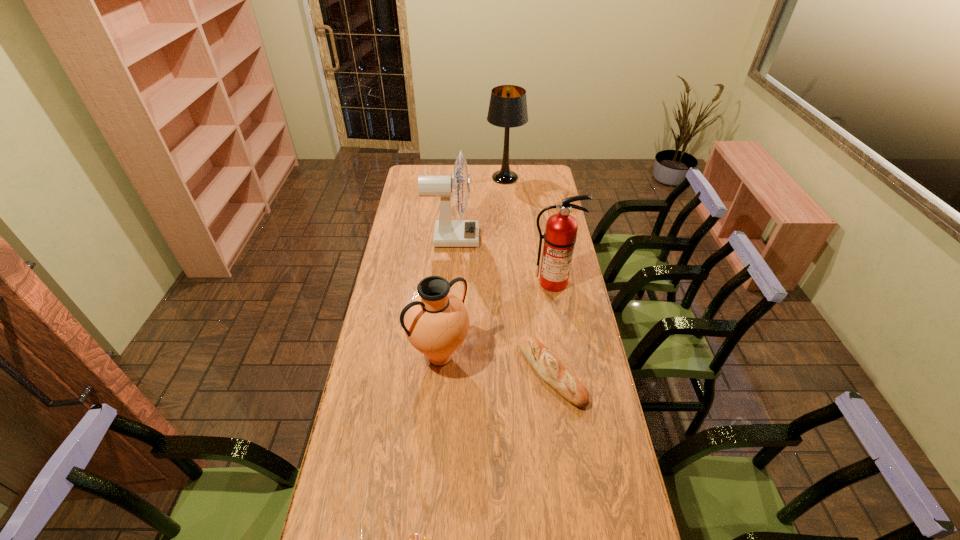
The image size is (960, 540). Identify the location of the farthest object. (508, 105).

The height and width of the screenshot is (540, 960). In order to click on the second farthest object in this screenshot , I will do `click(448, 233)`.

Where is `the fourth nearest object`? This screenshot has height=540, width=960. the fourth nearest object is located at coordinates (560, 235).

I want to click on pitcher, so click(x=436, y=322).

Find the location of a particular element. Image resolution: width=960 pixels, height=540 pixels. the shortest object is located at coordinates (545, 363).

This screenshot has width=960, height=540. In order to click on free spot located on the left of the table lamp in this screenshot , I will do `click(448, 178)`.

Where is `vacant space located 0.350m on the front-facing side of the fan`? The height and width of the screenshot is (540, 960). vacant space located 0.350m on the front-facing side of the fan is located at coordinates (554, 238).

The width and height of the screenshot is (960, 540). I want to click on vacant space situated at the nozzle of the fire extinguisher, so click(x=568, y=373).

Locate an element on the screen. This screenshot has height=540, width=960. vacant space located on the right of the fourth tallest object is located at coordinates (561, 357).

The height and width of the screenshot is (540, 960). Identify the location of vacant region located 0.240m on the front of the shortest object. (567, 489).